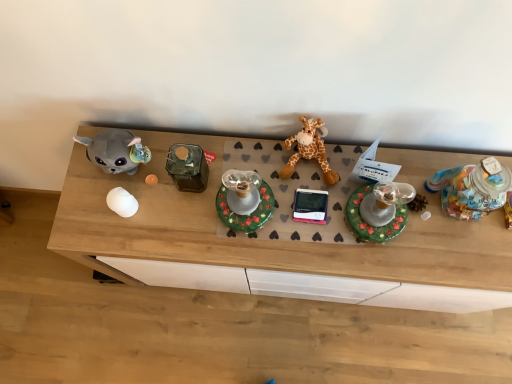
Where is `vacant space in front of orange plush giraffe at center`? This screenshot has width=512, height=384. vacant space in front of orange plush giraffe at center is located at coordinates (309, 223).